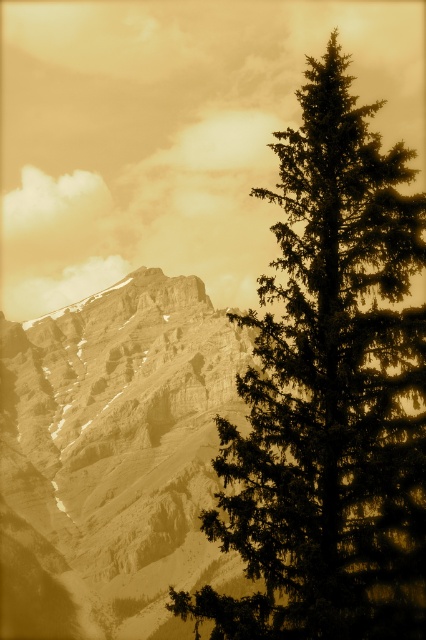
Can you confirm if green textured pine tree at right is taller than sepia textured mountain range at left?

No, green textured pine tree at right is not taller than sepia textured mountain range at left.

Between point (339, 545) and point (184, 362), which one is positioned in front?

Positioned in front is point (339, 545).

I want to click on green textured pine tree at right, so click(330, 396).